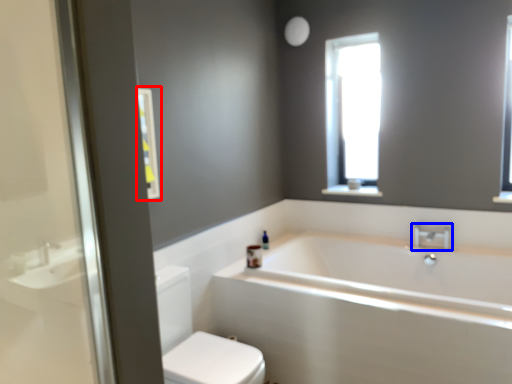
Question: Which point is closer to the camera, medicine cabinet (highlighted by a red box) or tap (highlighted by a blue box)?

Choices:
 (A) medicine cabinet
 (B) tap

Answer: (A)